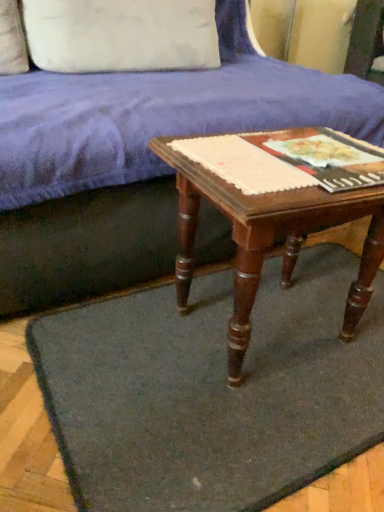
Find the location of a particular element. Image resolution: width=384 pixels, height=512 pixels. free space above matte paper at center, positioned as the first paperback book in left-to-right order (from a real-world perspective) is located at coordinates (295, 148).